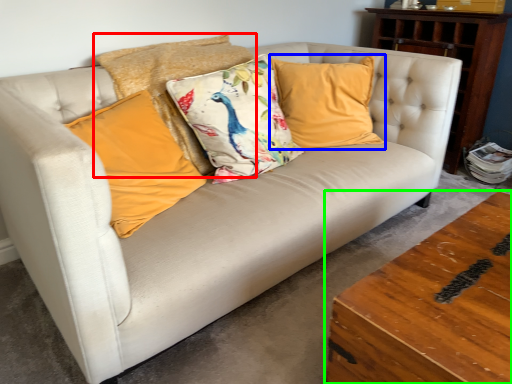
Question: Which object is positioned farthest from pillow (highlighted by a red box)? Select from pillow (highlighted by a blue box) and table (highlighted by a green box).

Choices:
 (A) pillow
 (B) table

Answer: (B)